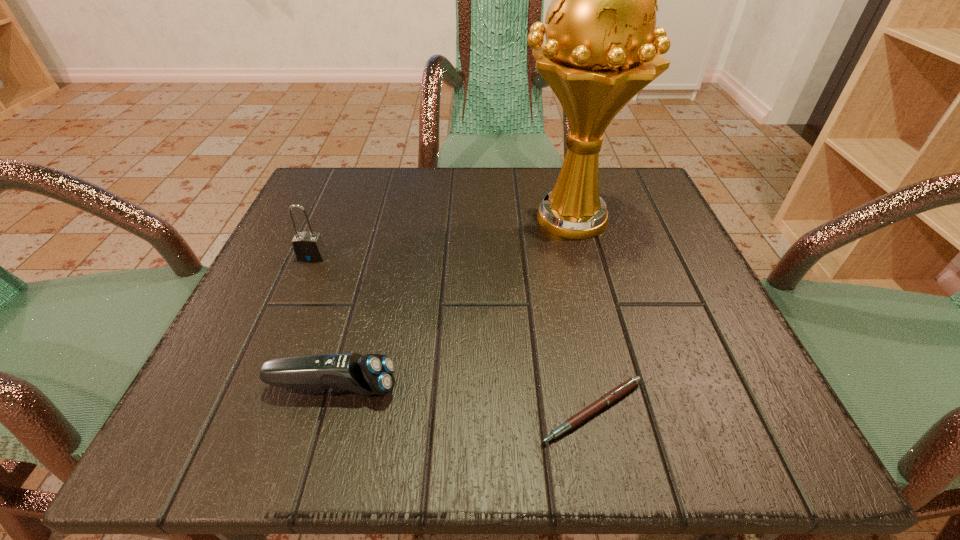
Locate an element on the screen. unoccupied area between the third tallest object and the trophy_cup is located at coordinates (451, 302).

I want to click on free point between the tallest object and the second tallest object, so click(x=441, y=237).

Locate an element on the screen. The height and width of the screenshot is (540, 960). vacant area between the trophy_cup and the electric shaver is located at coordinates (451, 302).

This screenshot has width=960, height=540. Find the location of `free space between the electric shaver and the trophy_cup`. free space between the electric shaver and the trophy_cup is located at coordinates (451, 302).

Where is `vacant point located between the tallest object and the pen`? The width and height of the screenshot is (960, 540). vacant point located between the tallest object and the pen is located at coordinates (581, 314).

The height and width of the screenshot is (540, 960). I want to click on free space between the electric shaver and the pen, so [463, 399].

Find the location of a particular element. This screenshot has height=540, width=960. the closest object relative to the second shortest object is located at coordinates (621, 390).

You are a GUI agent. You are given a task and a screenshot of the screen. Output one action in this format:
    pyautogui.click(x=<x>, y=<y>)
    Task: Click on the object that is the second closest one to the padlock
    
    Given the screenshot: What is the action you would take?
    pyautogui.click(x=602, y=44)

The width and height of the screenshot is (960, 540). Identify the location of vacant space that satisfies the following two spatial constraints: 1. at the front of the trophy_cup where the globe is prominent; 2. on the shackle of the second tallest object. (579, 256).

Where is `free space that satisfies the following two spatial constraints: 1. at the front of the tallest object where the globe is prominent; 2. at the nib of the shortest object`? The width and height of the screenshot is (960, 540). free space that satisfies the following two spatial constraints: 1. at the front of the tallest object where the globe is prominent; 2. at the nib of the shortest object is located at coordinates (617, 410).